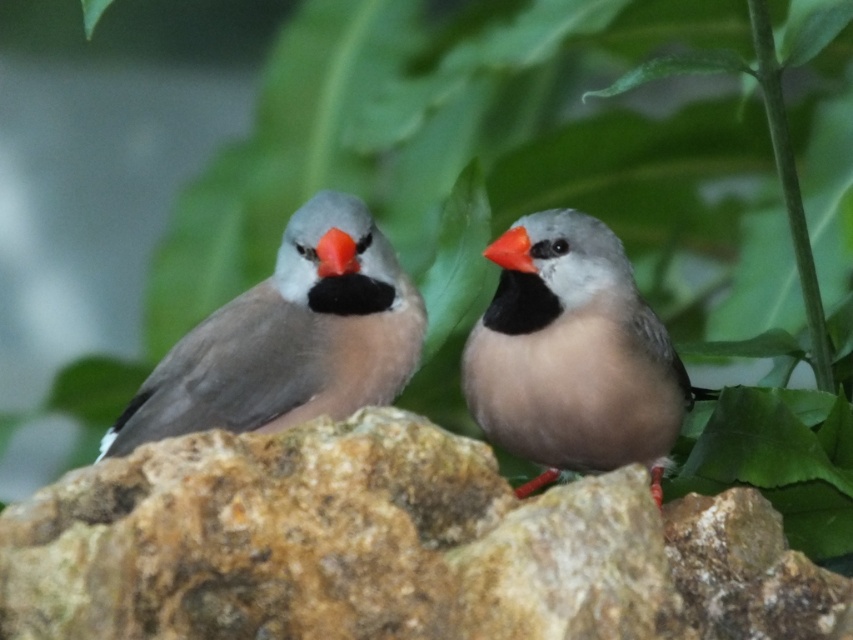
Does matte orange beak at left have a lesser width compared to orange matte beak at center?

Correct, matte orange beak at left's width is less than orange matte beak at center's.

Is matte orange beak at left below orange matte beak at center?

Indeed, matte orange beak at left is positioned under orange matte beak at center.

This screenshot has height=640, width=853. What do you see at coordinates (335, 253) in the screenshot? I see `matte orange beak at left` at bounding box center [335, 253].

The width and height of the screenshot is (853, 640). In order to click on matte orange beak at left in this screenshot , I will do `click(335, 253)`.

Consider the image. Is matte gray bird at center bigger than gray matte bird at left?

Correct, matte gray bird at center is larger in size than gray matte bird at left.

The image size is (853, 640). I want to click on matte gray bird at center, so click(x=575, y=358).

Can you confirm if brown rough rock at center is bigger than gray matte bird at left?

Yes.

Who is more distant from viewer, (334, 604) or (341, 372)?

Point (341, 372)

Describe the element at coordinates (392, 547) in the screenshot. I see `brown rough rock at center` at that location.

Locate an element on the screen. The width and height of the screenshot is (853, 640). brown rough rock at center is located at coordinates (392, 547).